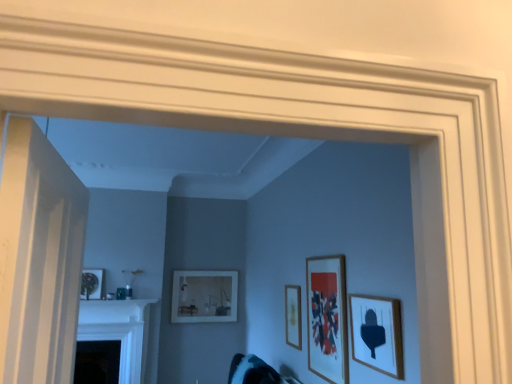
Question: Is teal fabric swivel chair at lower center at the back of wooden picture frame at center, the 2th picture frame when ordered from back to front?

Choices:
 (A) no
 (B) yes

Answer: (A)

Question: Is wooden picture frame at center, marked as the third picture frame in a front-to-back arrangement, further to the viewer compared to teal fabric swivel chair at lower center?

Choices:
 (A) yes
 (B) no

Answer: (A)

Question: Is wooden picture frame at center, which is the 2th picture frame in left-to-right order, smaller than teal fabric swivel chair at lower center?

Choices:
 (A) yes
 (B) no

Answer: (A)

Question: Considering the relative sizes of wooden picture frame at center, the 3th picture frame viewed from the right, and teal fabric swivel chair at lower center in the image provided, is wooden picture frame at center, the 3th picture frame viewed from the right, bigger than teal fabric swivel chair at lower center?

Choices:
 (A) yes
 (B) no

Answer: (B)

Question: Does wooden picture frame at center, the 2th picture frame when ordered from back to front, appear on the right side of teal fabric swivel chair at lower center?

Choices:
 (A) yes
 (B) no

Answer: (A)

Question: Could you tell me if wooden picture frame at center, the 2th picture frame when ordered from back to front, is facing teal fabric swivel chair at lower center?

Choices:
 (A) no
 (B) yes

Answer: (A)

Question: From a real-world perspective, is white wooden door at left below wooden picture frame at right, which ranks as the 1th picture frame in right-to-left order?

Choices:
 (A) no
 (B) yes

Answer: (A)

Question: From a real-world perspective, is white wooden door at left on top of wooden picture frame at right, the 1th picture frame when ordered from front to back?

Choices:
 (A) no
 (B) yes

Answer: (B)

Question: Does white wooden door at left have a lesser width compared to wooden picture frame at right, acting as the fourth picture frame starting from the left?

Choices:
 (A) no
 (B) yes

Answer: (A)

Question: From the image's perspective, is white wooden door at left on wooden picture frame at right, which ranks as the 1th picture frame in right-to-left order?

Choices:
 (A) yes
 (B) no

Answer: (A)

Question: Considering the relative sizes of white wooden door at left and wooden picture frame at right, the 1th picture frame when ordered from front to back, in the image provided, is white wooden door at left bigger than wooden picture frame at right, the 1th picture frame when ordered from front to back,?

Choices:
 (A) no
 (B) yes

Answer: (B)

Question: Is white wooden door at left positioned beyond the bounds of wooden picture frame at right, which ranks as the 1th picture frame in right-to-left order?

Choices:
 (A) no
 (B) yes

Answer: (B)

Question: Is teal fabric swivel chair at lower center in contact with black glossy fireplace at lower left?

Choices:
 (A) yes
 (B) no

Answer: (B)